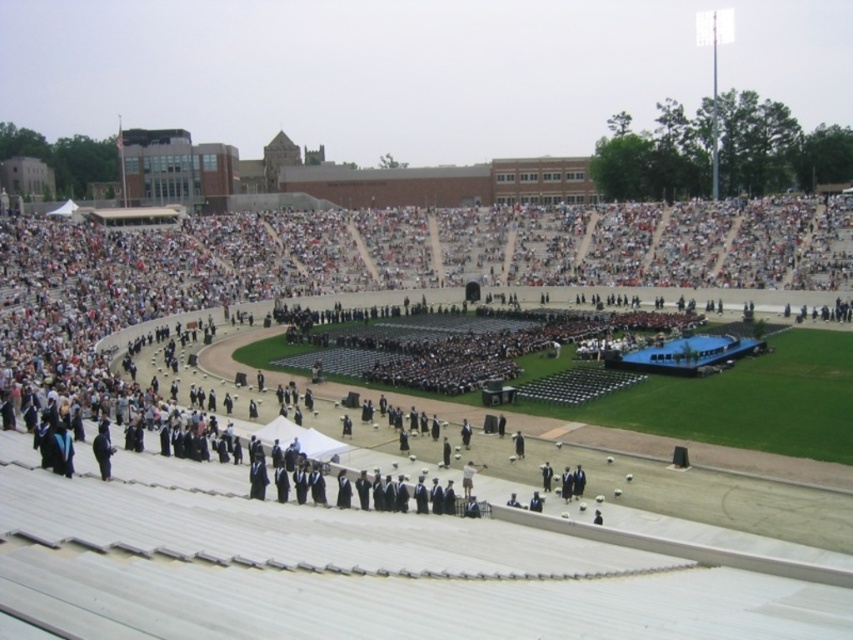
You are a photographer at the graduation ceremony. You want to take a photo that includes both the black graduation gown at center and the black matte suit at lower left. Which one will appear larger in the photo?

The black graduation gown at center will appear larger in the photo because it is much taller than the black matte suit at lower left.

You are a photographer positioned at the back of the bleachers. You need to take a photo that includes both the black graduation gown at center and the black matte suit at lower left. Which object should you focus on first to ensure both are in frame?

The black graduation gown at center is closer to you than the black matte suit at lower left, so you should focus on the black graduation gown at center first to ensure both are in frame.